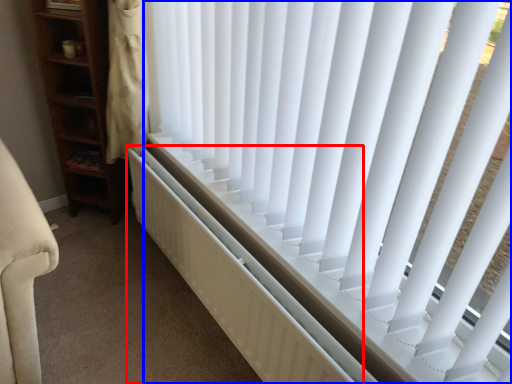
Question: Which point is closer to the camera, radiator (highlighted by a red box) or window blind (highlighted by a blue box)?

Choices:
 (A) radiator
 (B) window blind

Answer: (B)